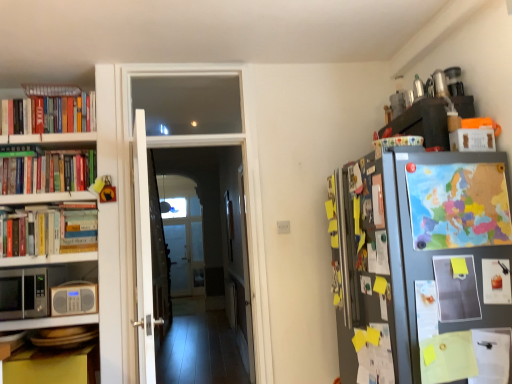
Question: In terms of width, does beige plastic radio at lower left look wider or thinner when compared to white wooden door at center, which is the 1th door from right to left?

Choices:
 (A) wide
 (B) thin

Answer: (B)

Question: Would you say beige plastic radio at lower left is inside or outside white wooden door at center, which is the 1th door from right to left?

Choices:
 (A) inside
 (B) outside

Answer: (B)

Question: Estimate the real-world distances between objects in this image. Which object is farther from the colorful paper map at right, which is the 5th book in left-to-right order?

Choices:
 (A) hardcover books at left, placed as the first book when sorted from left to right
 (B) white glossy door at center, positioned as the 2th door in right-to-left order
 (C) beige plastic radio at lower left
 (D) hardcover books at left, the second book in the left-to-right sequence
 (E) white wooden door at center

Answer: (B)

Question: Which object is positioned farthest from the white wooden door at center, the first door when ordered from left to right?

Choices:
 (A) beige plastic radio at lower left
 (B) colorful paper map at right, which appears as the first book when viewed from the right
 (C) hardcover books at left, positioned as the fourth book in front-to-back order
 (D) hardcover books at left, placed as the first book when sorted from left to right
 (E) white wooden door at center, the 3th door from the left

Answer: (B)